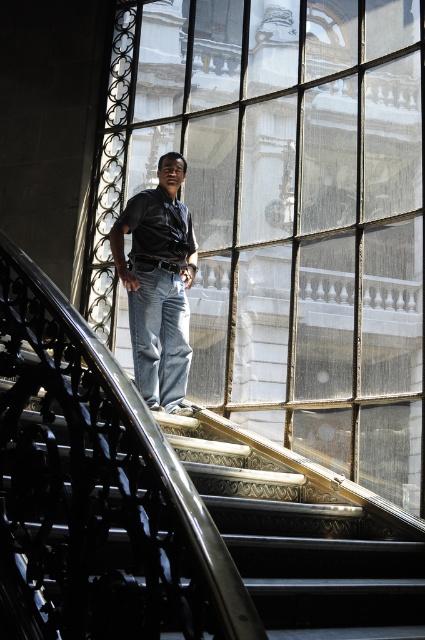
Is clear glass window at center wider than matte black shirt at center?

Yes.

Does clear glass window at center have a greater height compared to matte black shirt at center?

Yes.

This screenshot has height=640, width=425. What do you see at coordinates (283, 214) in the screenshot?
I see `clear glass window at center` at bounding box center [283, 214].

This screenshot has height=640, width=425. Find the location of `clear glass window at center`. clear glass window at center is located at coordinates (283, 214).